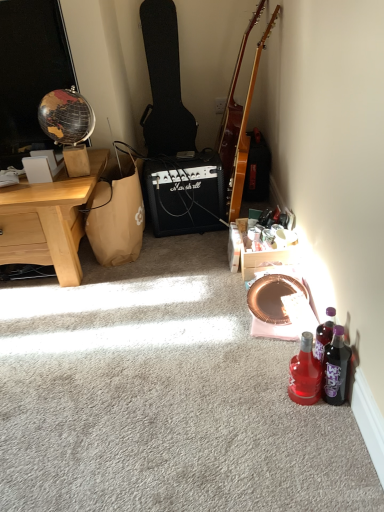
Question: In the image, is light brown wood desk at left on the left side or the right side of translucent purple bottle at lower right, the second bottle positioned from the left?

Choices:
 (A) right
 (B) left

Answer: (B)

Question: Considering their positions, is light brown wood desk at left located in front of or behind translucent purple bottle at lower right, the second bottle positioned from the left?

Choices:
 (A) behind
 (B) front

Answer: (A)

Question: Which object is the farthest from the wooden crate at lower right?

Choices:
 (A) light brown wood desk at left
 (B) black plastic marshall amplifier at center
 (C) black textured guitar case at center-left, arranged as the 1th guitar when viewed from the left
 (D) glossy wood guitar at upper right, which appears as the second guitar when viewed from the left
 (E) translucent purple bottle at lower right, the second bottle positioned from the left

Answer: (C)

Question: Based on their relative distances, which object is farther from the translucent purple bottle at lower right, the second bottle positioned from the left?

Choices:
 (A) translucent red glass bottle at lower right, positioned as the 1th bottle in left-to-right order
 (B) brown paper bag at left
 (C) black textured guitar case at center-left, arranged as the 1th guitar when viewed from the left
 (D) light brown wood desk at left
 (E) black plastic marshall amplifier at center

Answer: (C)